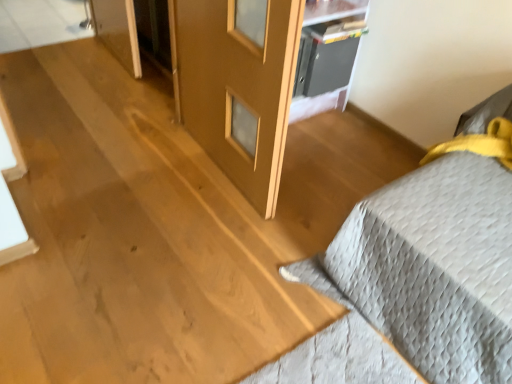
Locate an element on the screen. The image size is (512, 384). free spot to the left of matte wood screen door at center is located at coordinates (129, 173).